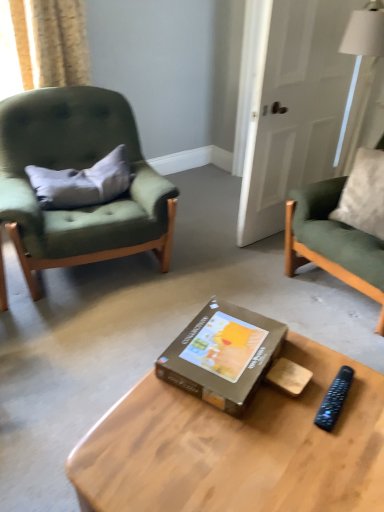
You are a GUI agent. You are given a task and a screenshot of the screen. Output one action in this format:
    pyautogui.click(x=<x>, y=<y>)
    Task: Click on the vacant region to the left of black plastic remote at lower right
    Image resolution: width=384 pixels, height=512 pixels.
    Given the screenshot: What is the action you would take?
    pyautogui.click(x=288, y=406)